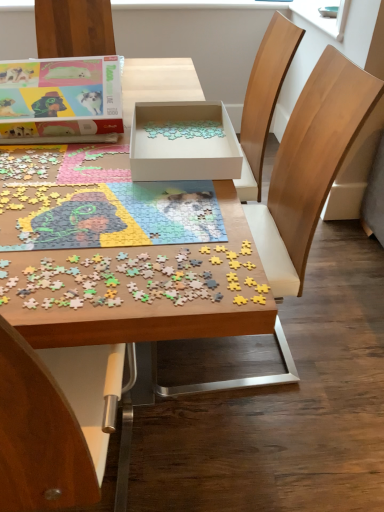
Question: Does matte cardboard box at upper left, placed as the first box when sorted from left to right, lie behind wooden chair at center?

Choices:
 (A) yes
 (B) no

Answer: (A)

Question: Is wooden chair at center a part of matte cardboard box at upper left, placed as the 2th box when sorted from right to left?

Choices:
 (A) no
 (B) yes

Answer: (A)

Question: Is matte cardboard box at upper left, placed as the first box when sorted from left to right, not close to wooden chair at center?

Choices:
 (A) no
 (B) yes

Answer: (A)

Question: Does matte cardboard box at upper left, placed as the 2th box when sorted from right to left, have a lesser width compared to wooden chair at center?

Choices:
 (A) yes
 (B) no

Answer: (A)

Question: Is matte cardboard box at upper left, placed as the first box when sorted from left to right, bigger than wooden chair at center?

Choices:
 (A) no
 (B) yes

Answer: (A)

Question: From a real-world perspective, is wooden puzzle pieces at center physically located above or below matte cardboard box at upper left, placed as the 2th box when sorted from right to left?

Choices:
 (A) above
 (B) below

Answer: (B)

Question: Is wooden puzzle pieces at center bigger or smaller than matte cardboard box at upper left, placed as the 2th box when sorted from right to left?

Choices:
 (A) big
 (B) small

Answer: (A)

Question: Is point (41, 450) closer or farther from the camera than point (102, 60)?

Choices:
 (A) closer
 (B) farther

Answer: (A)

Question: Is wooden puzzle pieces at center inside the boundaries of matte cardboard box at upper left, placed as the first box when sorted from left to right, or outside?

Choices:
 (A) outside
 (B) inside

Answer: (A)

Question: Considering the positions of matte cardboard box at upper left, placed as the first box when sorted from left to right, and wooden puzzle pieces at center, acting as the 1th jigsaw puzzle starting from the top, in the image, is matte cardboard box at upper left, placed as the first box when sorted from left to right, wider or thinner than wooden puzzle pieces at center, acting as the 1th jigsaw puzzle starting from the top,?

Choices:
 (A) wide
 (B) thin

Answer: (B)

Question: Is matte cardboard box at upper left, placed as the first box when sorted from left to right, in front of or behind wooden puzzle pieces at center, arranged as the 1th jigsaw puzzle when viewed from the back, in the image?

Choices:
 (A) behind
 (B) front

Answer: (A)

Question: Is matte cardboard box at upper left, placed as the 2th box when sorted from right to left, inside or outside of wooden puzzle pieces at center, acting as the 1th jigsaw puzzle starting from the top?

Choices:
 (A) inside
 (B) outside

Answer: (B)

Question: In terms of size, does matte cardboard box at upper left, placed as the 2th box when sorted from right to left, appear bigger or smaller than wooden puzzle pieces at center, arranged as the 1th jigsaw puzzle when viewed from the back?

Choices:
 (A) big
 (B) small

Answer: (A)

Question: Is wooden puzzle pieces at center, arranged as the 1th jigsaw puzzle when viewed from the back, taller or shorter than white cardboard box at center, the second box when ordered from left to right?

Choices:
 (A) tall
 (B) short

Answer: (B)

Question: Considering their positions, is wooden puzzle pieces at center, acting as the 1th jigsaw puzzle starting from the top, located in front of or behind white cardboard box at center, the second box when ordered from left to right?

Choices:
 (A) front
 (B) behind

Answer: (A)